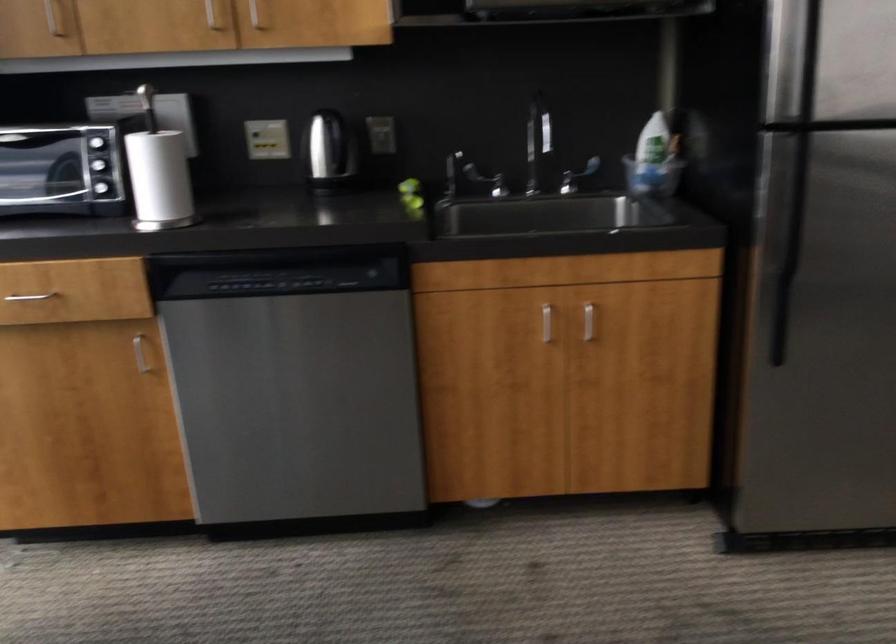
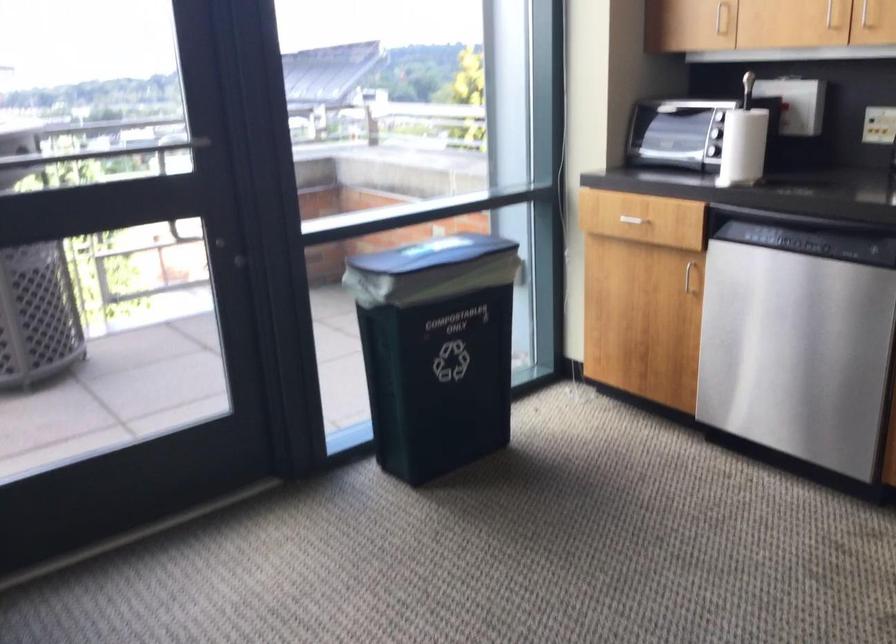
Question: The camera is either moving clockwise (left) or counter-clockwise (right) around the object. The first image is from the beginning of the video and the second image is from the end. Is the camera moving left or right when shooting the video?

Choices:
 (A) Left
 (B) Right

Answer: (B)